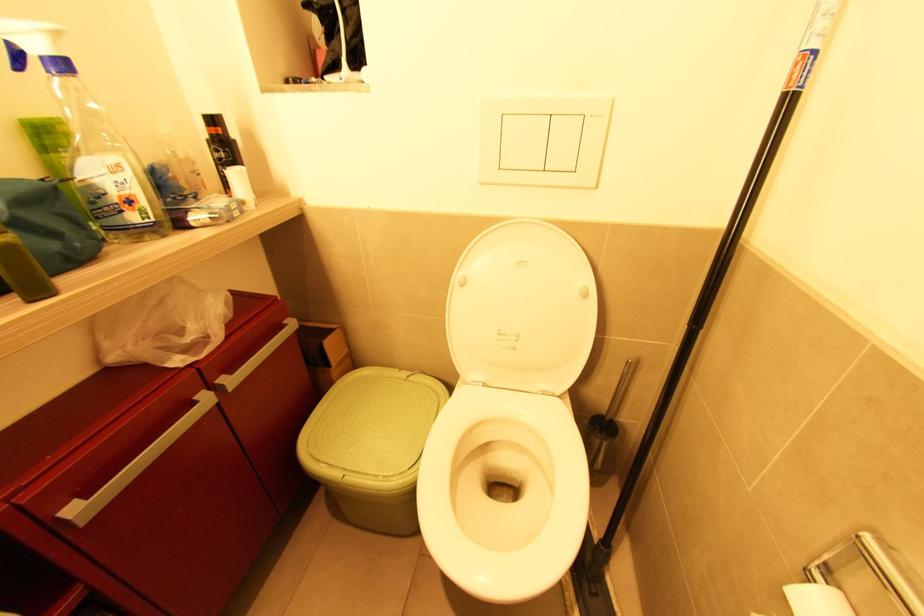
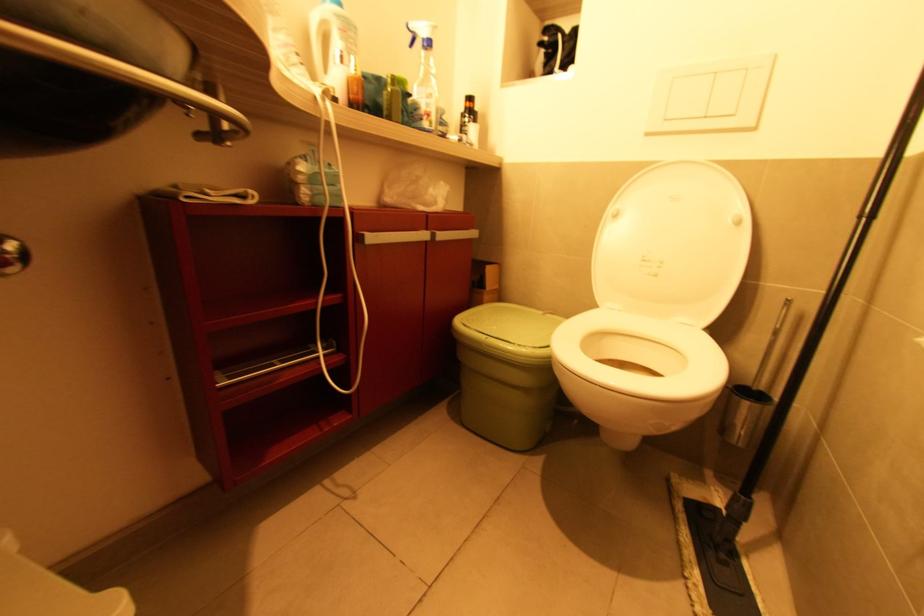
Locate, in the second image, the point that corresponds to (409,378) in the first image.

(545, 314)